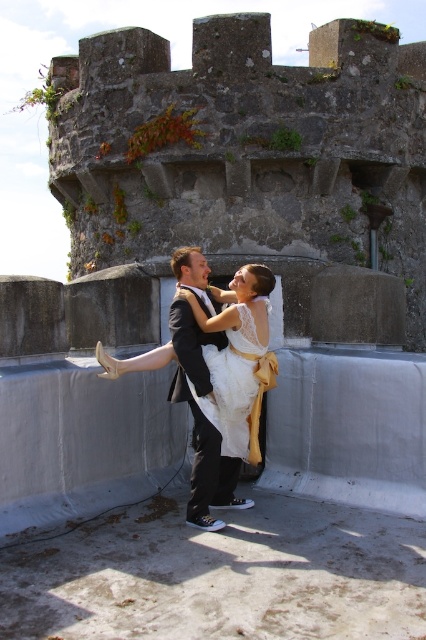
Question: Is white satin dress at center bigger than white lace dress at center?

Choices:
 (A) yes
 (B) no

Answer: (A)

Question: Does white satin dress at center have a larger size compared to white lace dress at center?

Choices:
 (A) yes
 (B) no

Answer: (A)

Question: Is white satin dress at center thinner than white lace dress at center?

Choices:
 (A) no
 (B) yes

Answer: (A)

Question: Among these objects, which one is nearest to the camera?

Choices:
 (A) white lace dress at center
 (B) white satin dress at center

Answer: (B)

Question: Which object appears closest to the camera in this image?

Choices:
 (A) white lace dress at center
 (B) white satin dress at center

Answer: (B)